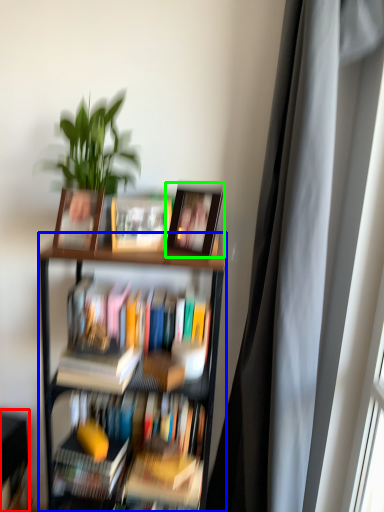
Question: Which is farther away from shelf (highlighted by a red box)? bookcase (highlighted by a blue box) or picture frame (highlighted by a green box)?

Choices:
 (A) bookcase
 (B) picture frame

Answer: (B)